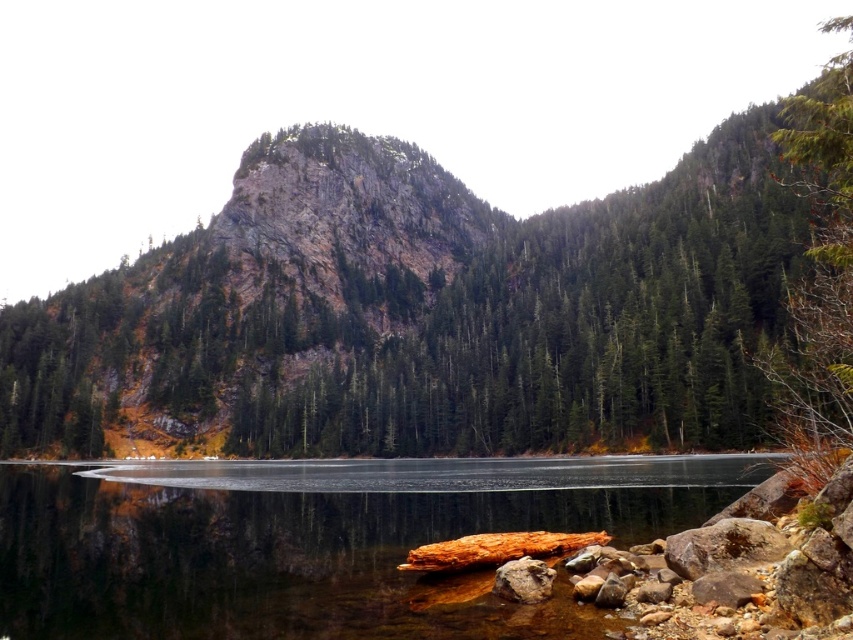
You are standing at the edge of the water and want to reach the green textured tree at right without getting your feet wet. Can you walk directly to it from the smooth rock water at center?

The smooth rock water at center is closer to the viewer than the green textured tree at right, so you can walk directly to the green textured tree at right from the smooth rock water at center without getting wet.

You are standing at the edge of the water in the serene landscape scene. There are two points marked in the image, one at coordinates point (846, 378) and another at point (529, 593). Which of these two points is nearer to your current position?

Point (846, 378) is closer to the viewer than point (529, 593), so the point at coordinates point (846, 378) is nearer to your current position.